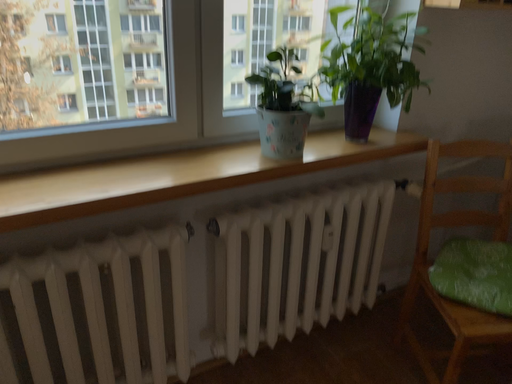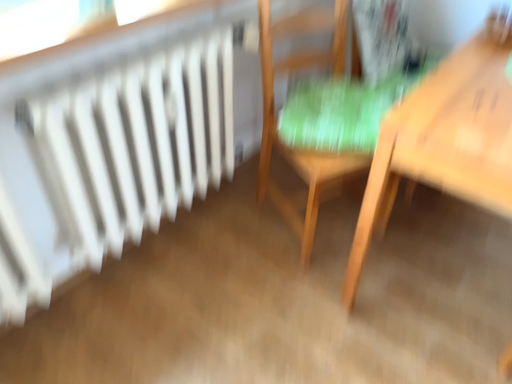
Question: Which way did the camera rotate in the video?

Choices:
 (A) rotated upward
 (B) rotated downward

Answer: (B)